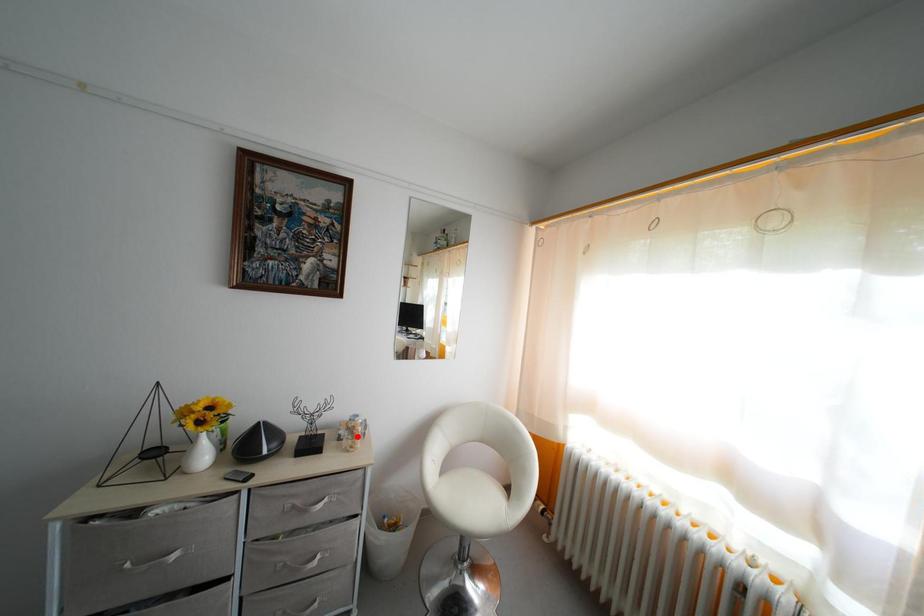
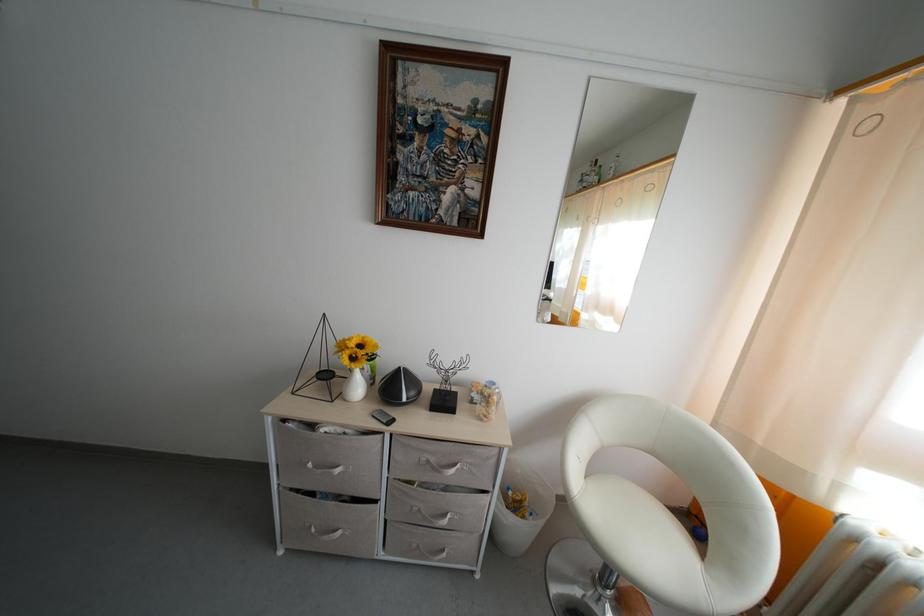
Question: I am providing you with two images of the same scene from different viewpoints. In image1, a red point is highlighted. Considering the same 3D point in image2, which of the following is correct?

Choices:
 (A) It is closer
 (B) It is farther

Answer: (B)